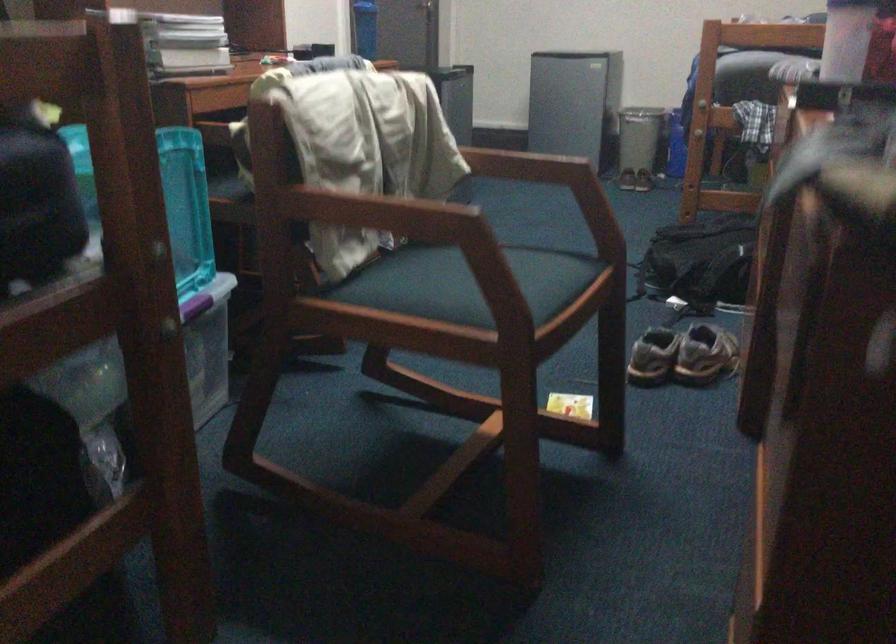
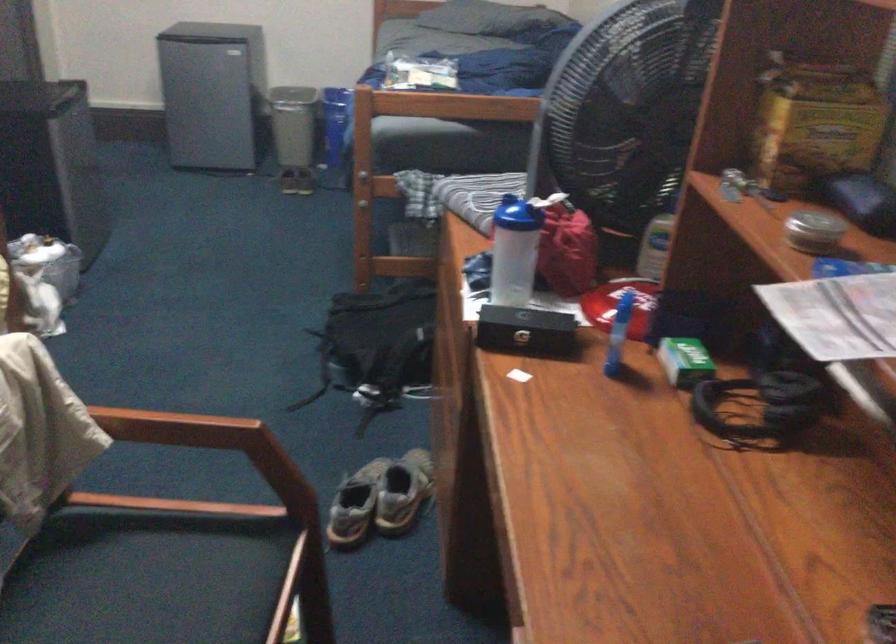
The point at (641, 125) is marked in the first image. Where is the corresponding point in the second image?

(293, 124)